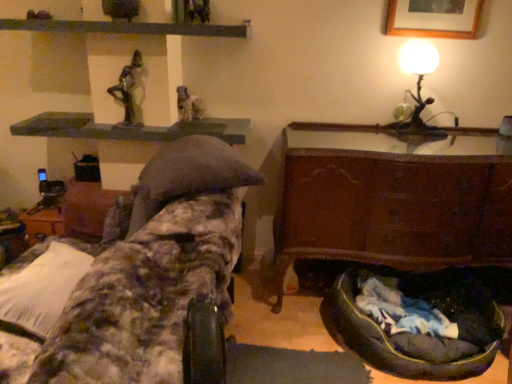
Question: In the image, is green matte shelf at upper center, which is the 1th shelf in top-to-bottom order, positioned in front of or behind dark gray fabric bean bag at lower right?

Choices:
 (A) behind
 (B) front

Answer: (A)

Question: In terms of width, does green matte shelf at upper center, which is the 1th shelf in top-to-bottom order, look wider or thinner when compared to dark gray fabric bean bag at lower right?

Choices:
 (A) wide
 (B) thin

Answer: (B)

Question: Which is farther from the metallic matte table lamp at upper right?

Choices:
 (A) green matte shelf at upper center, which is the 1th shelf in top-to-bottom order
 (B) green metallic statue at upper center, arranged as the first sculpture when viewed from the front
 (C) dark gray fabric bean bag at lower right
 (D) matte stone statue at upper center, marked as the 2th sculpture in a front-to-back arrangement
 (E) green concrete shelf at upper center, placed as the 2th shelf when sorted from top to bottom

Answer: (B)

Question: Which is farther from the green metallic statue at upper center, which is the second sculpture from back to front?

Choices:
 (A) rustic wood chest at lower right, which appears as the first furniture when viewed from the right
 (B) green matte shelf at upper center, which is the 1th shelf in top-to-bottom order
 (C) dark gray fabric bean bag at lower right
 (D) green concrete shelf at upper center, placed as the 2th shelf when sorted from top to bottom
 (E) camouflage fabric bedroll at left, which is the 1th furniture in left-to-right order

Answer: (C)